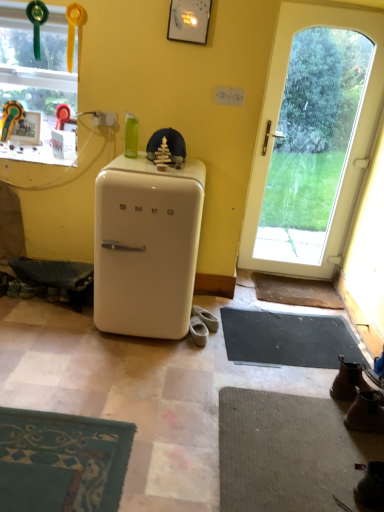
Question: From the image's perspective, is black rubber yoga mat at lower right above or below brown leather doormat at lower right?

Choices:
 (A) below
 (B) above

Answer: (A)

Question: Looking at the image, does black rubber yoga mat at lower right seem bigger or smaller compared to brown leather doormat at lower right?

Choices:
 (A) big
 (B) small

Answer: (A)

Question: Based on their relative distances, which object is nearer to the transparent glass window at upper left?

Choices:
 (A) white glass door at right
 (B) brown leather doormat at lower right
 (C) white matte refrigerator at center
 (D) beige suede shoes at lower center, which is counted as the first footwear, starting from the top
 (E) brown leather boot at lower right, placed as the 1th footwear when sorted from front to back

Answer: (C)

Question: Which is nearer to the beige suede shoes at lower center, the second footwear viewed from the back?

Choices:
 (A) black rubber yoga mat at lower right
 (B) brown leather boot at lower right, placed as the 1th footwear when sorted from front to back
 (C) transparent glass window at upper left
 (D) white matte refrigerator at center
 (E) beige suede shoes at lower center, acting as the 2th footwear starting from the left

Answer: (E)